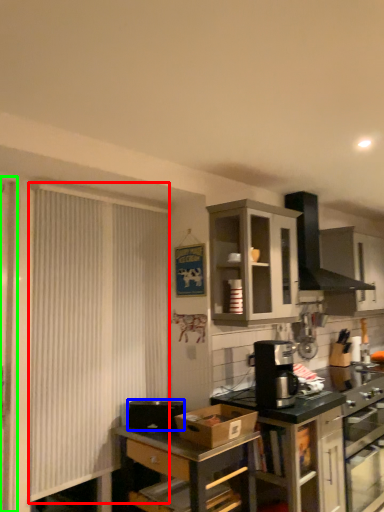
Question: Which is farther away from curtain (highlighted by a red box)? appliance (highlighted by a blue box) or screen door (highlighted by a green box)?

Choices:
 (A) appliance
 (B) screen door

Answer: (A)